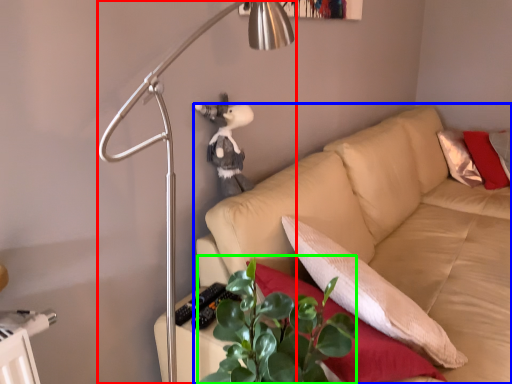
Question: Based on their relative distances, which object is farther from lamp (highlighted by a red box)? Choose from studio couch (highlighted by a blue box) and plant (highlighted by a green box).

Choices:
 (A) studio couch
 (B) plant

Answer: (A)